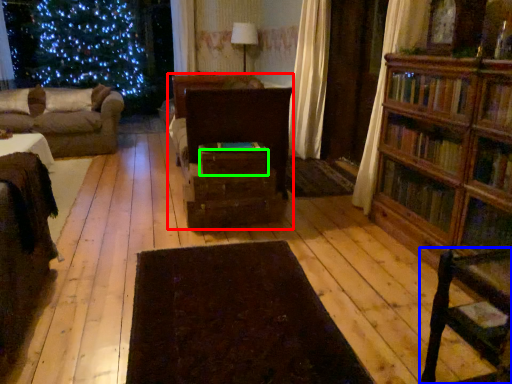
Question: Based on their relative distances, which object is farther from entertainment center (highlighted by a red box)? Choose from chair (highlighted by a blue box) and drawer (highlighted by a green box).

Choices:
 (A) chair
 (B) drawer

Answer: (A)